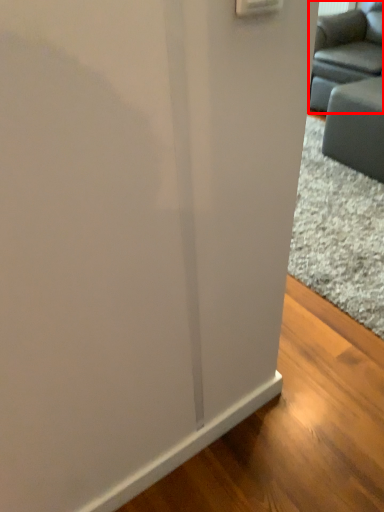
Question: From the image's perspective, what is the correct spatial relationship of studio couch (annotated by the red box) in relation to furniture?

Choices:
 (A) below
 (B) above

Answer: (B)